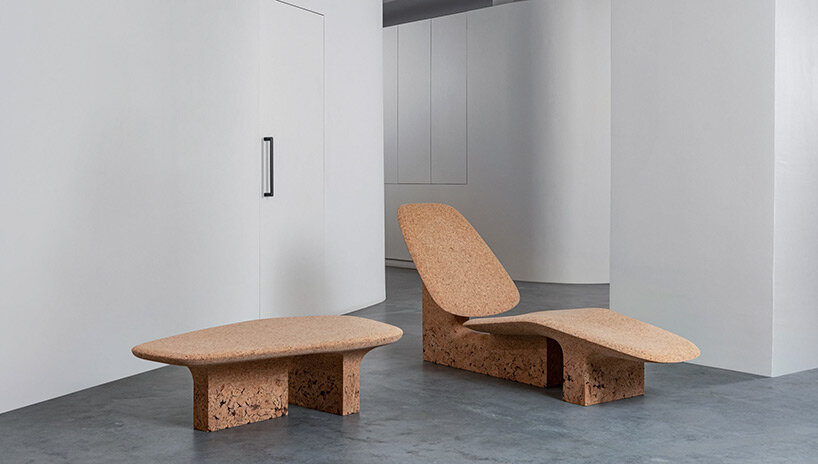
The image size is (818, 464). What are the coordinates of `door` in the screenshot? It's located at tap(299, 152).